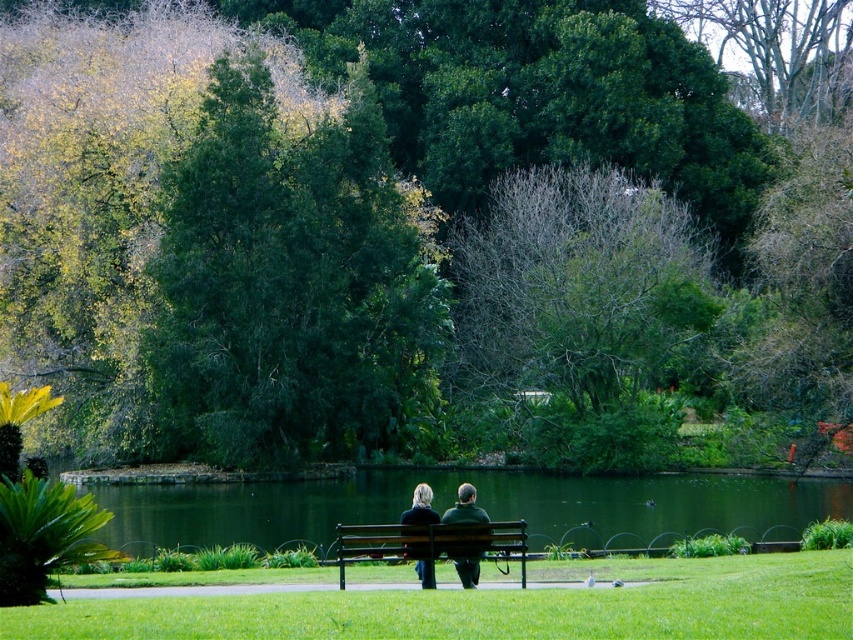
You are standing at the park and see the point marked as point (477, 502). What is the nearest object to this point?

The nearest object to point (477, 502) is the green liquid water at center.